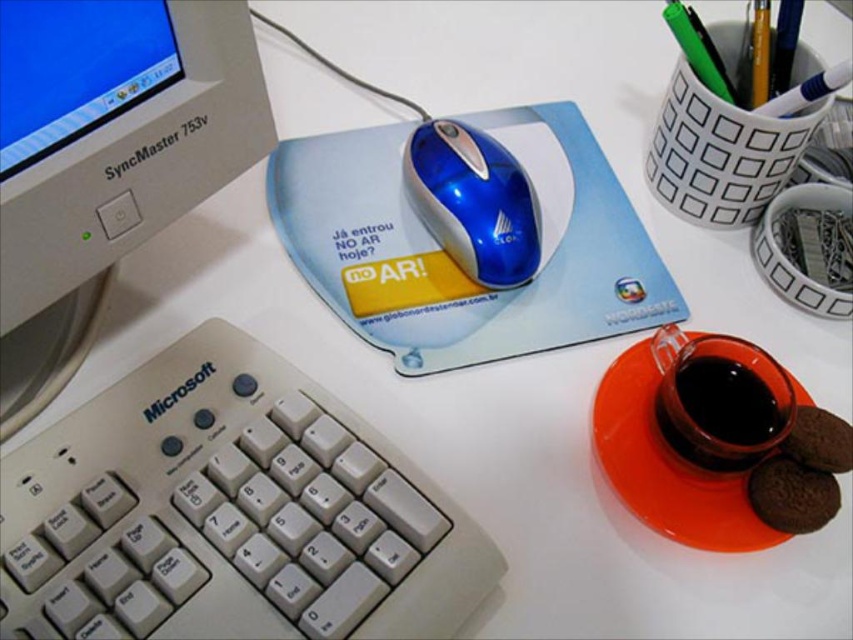
Question: Is white plastic keyboard at lower left above white plastic monitor at upper left?

Choices:
 (A) no
 (B) yes

Answer: (A)

Question: Can you confirm if white plastic keyboard at lower left is thinner than black glossy cup at right?

Choices:
 (A) no
 (B) yes

Answer: (A)

Question: Is the position of white plastic monitor at upper left more distant than that of black glossy cup at right?

Choices:
 (A) yes
 (B) no

Answer: (B)

Question: Which point is farther from the camera taking this photo?

Choices:
 (A) (144, 477)
 (B) (730, 369)
 (C) (16, 77)
 (D) (488, 166)

Answer: (D)

Question: Which point is closer to the camera?

Choices:
 (A) (448, 193)
 (B) (50, 131)
 (C) (88, 410)
 (D) (709, 451)

Answer: (B)

Question: Based on their relative distances, which object is farther from the white plastic monitor at upper left?

Choices:
 (A) black glossy cup at right
 (B) white plastic keyboard at lower left

Answer: (A)